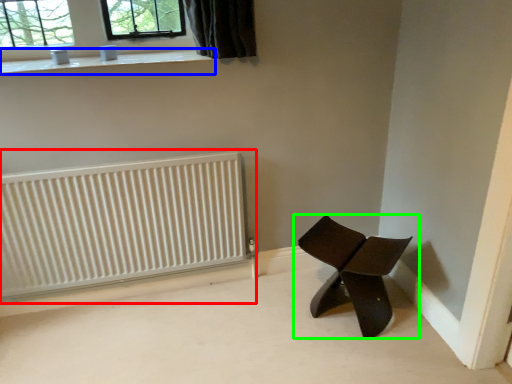
Question: Based on their relative distances, which object is nearer to radiator (highlighted by a red box)? Choose from window sill (highlighted by a blue box) and chair (highlighted by a green box).

Choices:
 (A) window sill
 (B) chair

Answer: (A)